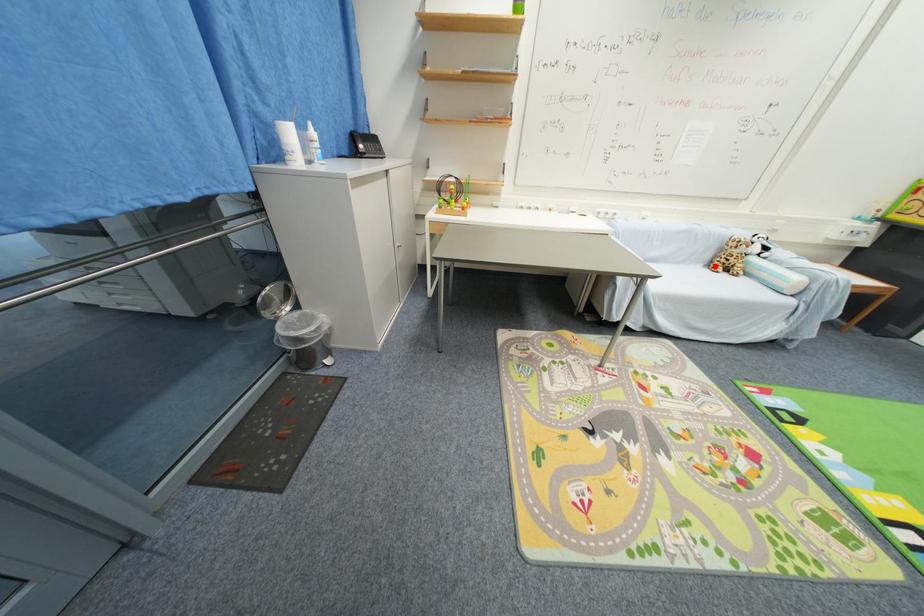
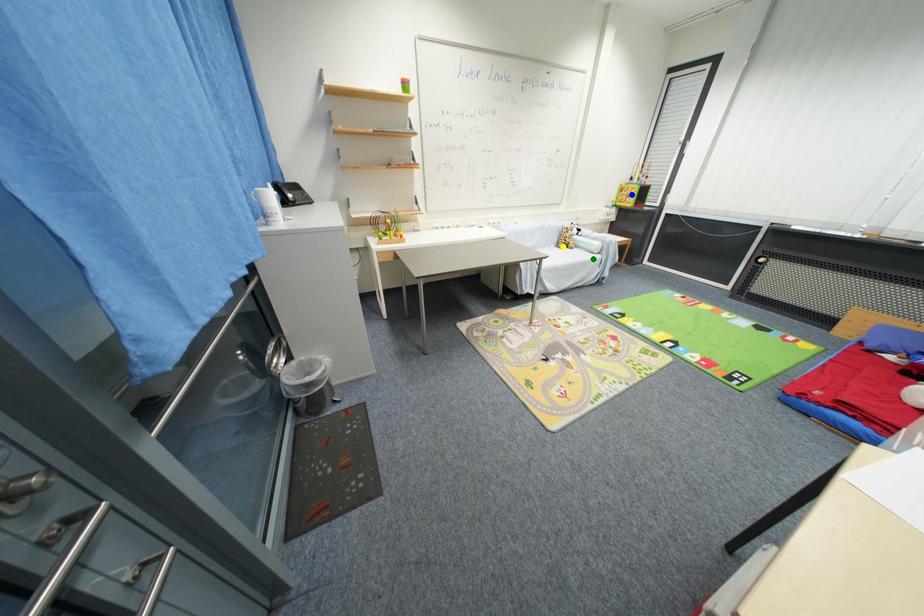
Question: I am providing you with two images of the same scene from different viewpoints. A red point is marked on the first image. You are given multiple points on the second image. Which point in image 2 is actually the same real-world point as the red point in image 1?

Choices:
 (A) green point
 (B) yellow point
 (C) blue point

Answer: (B)